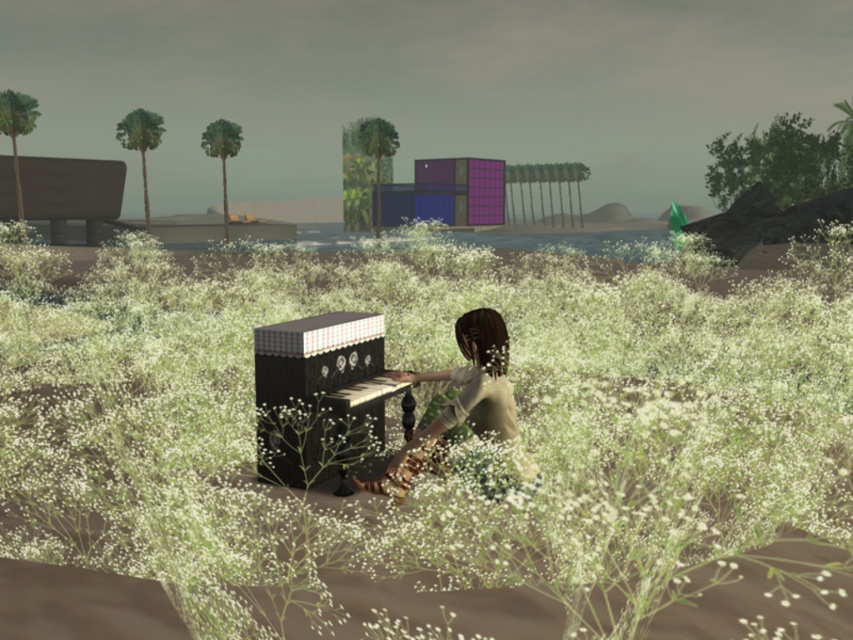
You are standing in the field of white flowers and want to sit down. Which object, the white fluffy grass at center or the matte brown hair at center, has a wider spread and would provide a more comfortable sitting area?

The white fluffy grass at center has a wider spread than the matte brown hair at center, so it would provide a more comfortable sitting area.

You are a photographer aiming to capture the person playing the piano in the scene. You notice the white fluffy grass at center and the matte brown hair at center. Which object should you focus on to ensure the person is clearly visible in your photo?

You should focus on the matte brown hair at center because it is below the white fluffy grass at center, making it closer to the person playing the piano. This will help ensure the person is clearly visible in the photo.